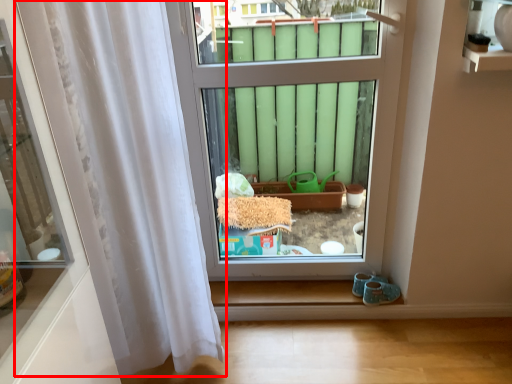
Question: From the image's perspective, where is curtain (annotated by the red box) located relative to window?

Choices:
 (A) below
 (B) above

Answer: (A)